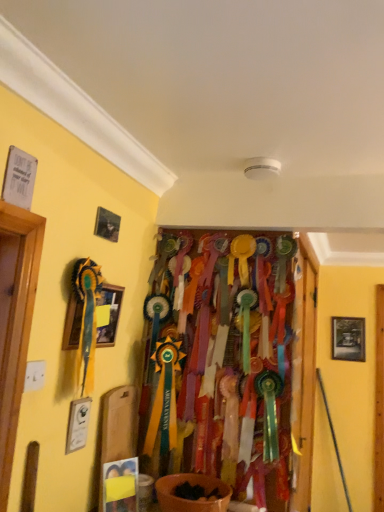
At what (x,y) coordinates should I click in order to perform the action: click on wooden door at center. Please return your answer as a coordinate pair (x, y). The image size is (384, 512). Looking at the image, I should click on (303, 381).

The width and height of the screenshot is (384, 512). I want to click on wooden framed picture at left, the second picture frame from the right, so click(109, 314).

What do you see at coordinates (348, 339) in the screenshot?
I see `wooden framed picture at right, the second picture frame positioned from the top` at bounding box center [348, 339].

Identify the location of wooden framed picture at right, the second picture frame positioned from the left. This screenshot has width=384, height=512. (348, 339).

The width and height of the screenshot is (384, 512). In order to click on wooden door at center in this screenshot , I will do `click(303, 381)`.

Consider the image. From the image's perspective, is wooden framed picture at right, the second picture frame positioned from the left, under wooden framed picture at left, positioned as the second picture frame in bottom-to-top order?

Yes, from the image's perspective, wooden framed picture at right, the second picture frame positioned from the left, is beneath wooden framed picture at left, positioned as the second picture frame in bottom-to-top order.

Which of these two, wooden framed picture at right, the first picture frame from the back, or wooden framed picture at left, arranged as the second picture frame when viewed from the back, is bigger?

wooden framed picture at left, arranged as the second picture frame when viewed from the back, is bigger.

Between wooden framed picture at right, marked as the 1th picture frame in a bottom-to-top arrangement, and wooden framed picture at left, which appears as the 1th picture frame when viewed from the front, which one has less height?

With less height is wooden framed picture at left, which appears as the 1th picture frame when viewed from the front.

Between point (352, 337) and point (64, 340), which one is positioned behind?

The point (352, 337) is farther.

From a real-world perspective, is wooden framed picture at left, the second picture frame from the right, over wooden door at center?

Yes, from a real-world perspective, wooden framed picture at left, the second picture frame from the right, is above wooden door at center.

Are wooden framed picture at left, which appears as the 1th picture frame when viewed from the front, and wooden door at center far apart?

No, there isn't a large distance between wooden framed picture at left, which appears as the 1th picture frame when viewed from the front, and wooden door at center.

Does wooden framed picture at left, positioned as the second picture frame in bottom-to-top order, come behind wooden door at center?

No, wooden framed picture at left, positioned as the second picture frame in bottom-to-top order, is closer to the camera.

From the image's perspective, would you say wooden framed picture at left, positioned as the second picture frame in bottom-to-top order, is positioned over wooden framed picture at right, which is the second picture frame in front-to-back order?

Yes, from the image's perspective, wooden framed picture at left, positioned as the second picture frame in bottom-to-top order, is above wooden framed picture at right, which is the second picture frame in front-to-back order.

Who is more distant, wooden framed picture at left, positioned as the second picture frame in bottom-to-top order, or wooden framed picture at right, which is the second picture frame in front-to-back order?

wooden framed picture at right, which is the second picture frame in front-to-back order, is further from the camera.

Find the location of `picture frame lying on the right of wooden framed picture at left, arranged as the second picture frame when viewed from the back`. picture frame lying on the right of wooden framed picture at left, arranged as the second picture frame when viewed from the back is located at coordinates (348, 339).

Considering the sizes of objects wooden framed picture at left, positioned as the second picture frame in bottom-to-top order, and wooden framed picture at right, marked as the 1th picture frame in a bottom-to-top arrangement, in the image provided, who is shorter, wooden framed picture at left, positioned as the second picture frame in bottom-to-top order, or wooden framed picture at right, marked as the 1th picture frame in a bottom-to-top arrangement,?

wooden framed picture at left, positioned as the second picture frame in bottom-to-top order.

Is wooden door at center outside of wooden framed picture at right, which is the second picture frame in front-to-back order?

That's correct, wooden door at center is outside of wooden framed picture at right, which is the second picture frame in front-to-back order.

Based on the photo, does wooden door at center appear on the left side of wooden framed picture at right, the first picture frame from the back?

Correct, you'll find wooden door at center to the left of wooden framed picture at right, the first picture frame from the back.

In the scene shown: From a real-world perspective, is wooden door at center positioned under wooden framed picture at right, the second picture frame positioned from the left, based on gravity?

Yes, from a real-world perspective, wooden door at center is below wooden framed picture at right, the second picture frame positioned from the left.

Could you measure the distance between wooden door at center and wooden framed picture at right, the second picture frame positioned from the top?

wooden door at center is 3.32 feet from wooden framed picture at right, the second picture frame positioned from the top.

Does wooden door at center have a lesser height compared to wooden framed picture at left, which appears as the 1th picture frame when viewed from the front?

No, wooden door at center is not shorter than wooden framed picture at left, which appears as the 1th picture frame when viewed from the front.

From a real-world perspective, is wooden door at center below wooden framed picture at left, arranged as the second picture frame when viewed from the back?

Yes, from a real-world perspective, wooden door at center is below wooden framed picture at left, arranged as the second picture frame when viewed from the back.

From the picture: How different are the orientations of wooden door at center and wooden framed picture at left, marked as the 1th picture frame in a left-to-right arrangement, in degrees?

1.13 degrees.

Is wooden door at center inside the boundaries of wooden framed picture at left, which appears as the 1th picture frame when viewed from the front, or outside?

wooden door at center lies outside wooden framed picture at left, which appears as the 1th picture frame when viewed from the front.

From the image's perspective, is wooden framed picture at right, the second picture frame positioned from the left, located above wooden door at center?

Incorrect, from the image's perspective, wooden framed picture at right, the second picture frame positioned from the left, is lower than wooden door at center.

Would you consider wooden framed picture at right, the first picture frame from the back, to be distant from wooden door at center?

wooden framed picture at right, the first picture frame from the back, is far away from wooden door at center.

From a real-world perspective, which object rests below the other?

In real-world perspective, wooden door at center is lower.

In order to click on picture frame located underneath the wooden framed picture at left, the 1th picture frame in the top-to-bottom sequence (from a real-world perspective) in this screenshot , I will do `click(348, 339)`.

From a real-world perspective, count 2nd picture frames upward from the wooden door at center and point to it. Please provide its 2D coordinates.

[(109, 314)]

Considering their positions, is wooden framed picture at right, the second picture frame positioned from the top, positioned closer to wooden framed picture at left, marked as the 1th picture frame in a left-to-right arrangement, than wooden door at center?

wooden door at center is positioned closer to the anchor wooden framed picture at left, marked as the 1th picture frame in a left-to-right arrangement.

Estimate the real-world distances between objects in this image. Which object is closer to wooden framed picture at right, the second picture frame positioned from the top, wooden door at center or wooden framed picture at left, which appears as the 1th picture frame when viewed from the front?

The object closer to wooden framed picture at right, the second picture frame positioned from the top, is wooden door at center.

Looking at the image, which one is located closer to wooden door at center, wooden framed picture at left, the 1th picture frame in the top-to-bottom sequence, or wooden framed picture at right, which is counted as the first picture frame, starting from the right?

Based on the image, wooden framed picture at left, the 1th picture frame in the top-to-bottom sequence, appears to be nearer to wooden door at center.

When comparing their distances from wooden door at center, does wooden framed picture at right, the second picture frame positioned from the left, or wooden framed picture at left, the second picture frame from the right, seem closer?

Among the two, wooden framed picture at left, the second picture frame from the right, is located nearer to wooden door at center.

Consider the image. Looking at the image, which one is located closer to wooden framed picture at left, arranged as the second picture frame when viewed from the back, wooden door at center or wooden framed picture at right, marked as the 1th picture frame in a bottom-to-top arrangement?

Among the two, wooden door at center is located nearer to wooden framed picture at left, arranged as the second picture frame when viewed from the back.

Based on their spatial positions, is wooden framed picture at left, marked as the 1th picture frame in a left-to-right arrangement, or wooden door at center closer to wooden framed picture at right, the second picture frame positioned from the top?

wooden door at center lies closer to wooden framed picture at right, the second picture frame positioned from the top, than the other object.

This screenshot has height=512, width=384. I want to click on door between wooden framed picture at left, which appears as the 1th picture frame when viewed from the front, and wooden framed picture at right, marked as the 1th picture frame in a bottom-to-top arrangement, along the z-axis, so click(x=303, y=381).